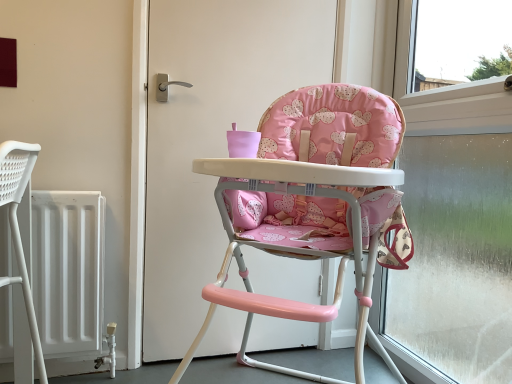
Looking at this image, measure the distance between white matte door at center and camera.

white matte door at center is 1.42 meters from camera.

Identify the location of transparent glass window at right. The height and width of the screenshot is (384, 512). (453, 228).

From a real-world perspective, which object rests below the other?

pink fabric highchair at center is physically lower.

From the image's perspective, which one is positioned higher, pink fabric highchair at center or white matte door at center?

white matte door at center is shown above in the image.

Does transparent glass window at right have a smaller size compared to white matte door at center?

No.

Considering the relative positions of transparent glass window at right and white matte door at center in the image provided, is transparent glass window at right to the left or to the right of white matte door at center?

transparent glass window at right is positioned on white matte door at center's right side.

Consider the image. Is transparent glass window at right positioned in front of white matte door at center?

That is True.

Find the location of a particular element. This screenshot has width=512, height=384. window frame that appears below the white matte door at center (from a real-world perspective) is located at coordinates (453, 228).

Is there a large distance between white matte door at center and pink fabric highchair at center?

white matte door at center is actually quite close to pink fabric highchair at center.

Based on the photo, from the image's perspective, is white matte door at center beneath pink fabric highchair at center?

No, from the image's perspective, white matte door at center is not below pink fabric highchair at center.

From a real-world perspective, is white matte door at center positioned above or below pink fabric highchair at center?

white matte door at center is above pink fabric highchair at center.

Measure the distance between white matte door at center and transparent glass window at right.

white matte door at center and transparent glass window at right are 26.27 inches apart.

The height and width of the screenshot is (384, 512). I want to click on window frame that appears below the white matte door at center (from the image's perspective), so click(453, 228).

From the picture: From the image's perspective, relative to transparent glass window at right, is white matte door at center above or below?

Based on their image positions, white matte door at center is located above transparent glass window at right.

Looking at this image, does white matte door at center have a greater width compared to transparent glass window at right?

No, white matte door at center is not wider than transparent glass window at right.

Looking at this image, from a real-world perspective, is pink fabric highchair at center beneath transparent glass window at right?

Correct, in the physical world, pink fabric highchair at center is lower than transparent glass window at right.

What's the angular difference between pink fabric highchair at center and transparent glass window at right's facing directions?

pink fabric highchair at center and transparent glass window at right are facing 47.5 degrees away from each other.

Is pink fabric highchair at center aimed at transparent glass window at right?

No, pink fabric highchair at center is not oriented towards transparent glass window at right.

Does point (371, 162) come behind point (510, 346)?

No, it is not.

From the image's perspective, which is above, transparent glass window at right or pink fabric highchair at center?

transparent glass window at right is shown above in the image.

Between transparent glass window at right and pink fabric highchair at center, which one is positioned behind?

transparent glass window at right is further away from the camera.

Considering the relative positions of transparent glass window at right and pink fabric highchair at center in the image provided, is transparent glass window at right to the left or to the right of pink fabric highchair at center?

transparent glass window at right is to the right of pink fabric highchair at center.

This screenshot has height=384, width=512. I want to click on window frame lying on the right of pink fabric highchair at center, so click(x=453, y=228).

Locate an element on the screen. The width and height of the screenshot is (512, 384). chair in front of the white matte door at center is located at coordinates (313, 204).

Identify the location of door above the transparent glass window at right (from a real-world perspective). This screenshot has height=384, width=512. (211, 135).

Based on their spatial positions, is white matte door at center or pink fabric highchair at center closer to transparent glass window at right?

The object closer to transparent glass window at right is pink fabric highchair at center.

Consider the image. Estimate the real-world distances between objects in this image. Which object is further from pink fabric highchair at center, white matte door at center or transparent glass window at right?

Based on the image, transparent glass window at right appears to be further to pink fabric highchair at center.

Looking at the image, which one is located closer to transparent glass window at right, pink fabric highchair at center or white matte door at center?

pink fabric highchair at center is positioned closer to the anchor transparent glass window at right.

Estimate the real-world distances between objects in this image. Which object is closer to white matte door at center, transparent glass window at right or pink fabric highchair at center?

pink fabric highchair at center is closer to white matte door at center.

Considering their positions, is transparent glass window at right positioned closer to pink fabric highchair at center than white matte door at center?

Based on the image, white matte door at center appears to be nearer to pink fabric highchair at center.

From the image, which object appears to be farther from white matte door at center, pink fabric highchair at center or transparent glass window at right?

transparent glass window at right is positioned further to the anchor white matte door at center.

At what (x,y) coordinates should I click in order to perform the action: click on window frame located between pink fabric highchair at center and white matte door at center in the depth direction. Please return your answer as a coordinate pair (x, y). Looking at the image, I should click on (453, 228).